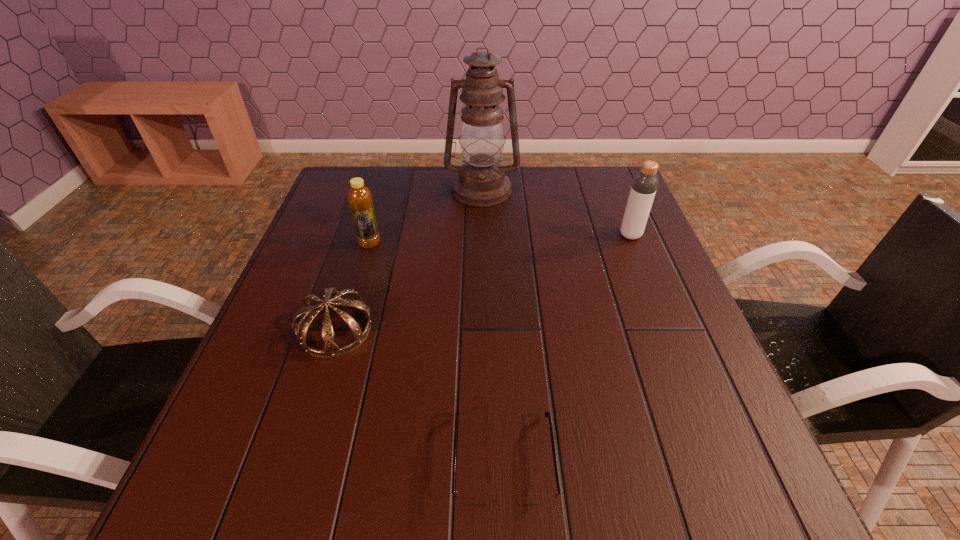
Identify the location of vacant region between the shortest object and the rightmost object. (567, 348).

This screenshot has height=540, width=960. I want to click on free area in between the tiara and the left bottle, so click(x=352, y=287).

This screenshot has height=540, width=960. Find the location of `object that is the third closest to the second nearest object`. object that is the third closest to the second nearest object is located at coordinates (481, 182).

Locate an element on the screen. object that stands as the third closest to the left bottle is located at coordinates (466, 500).